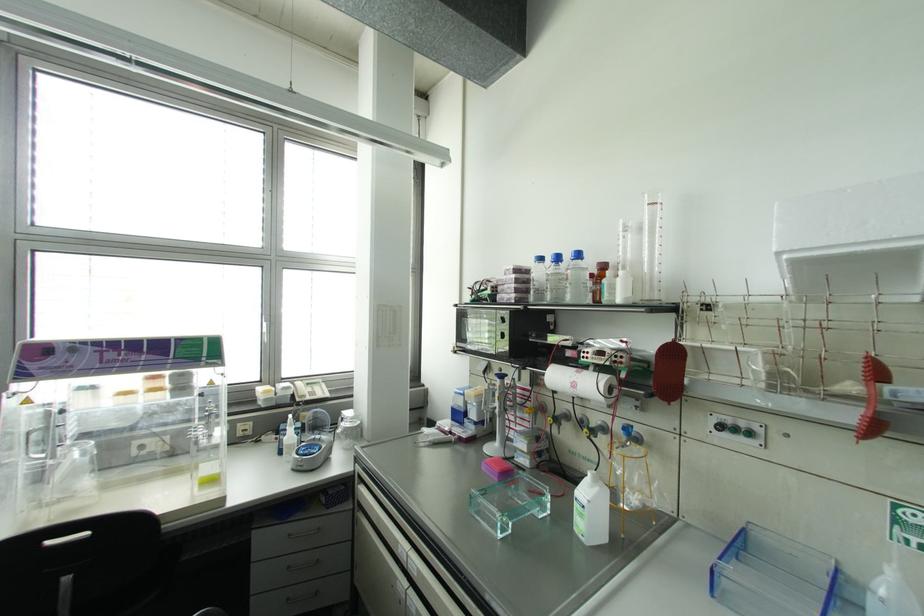
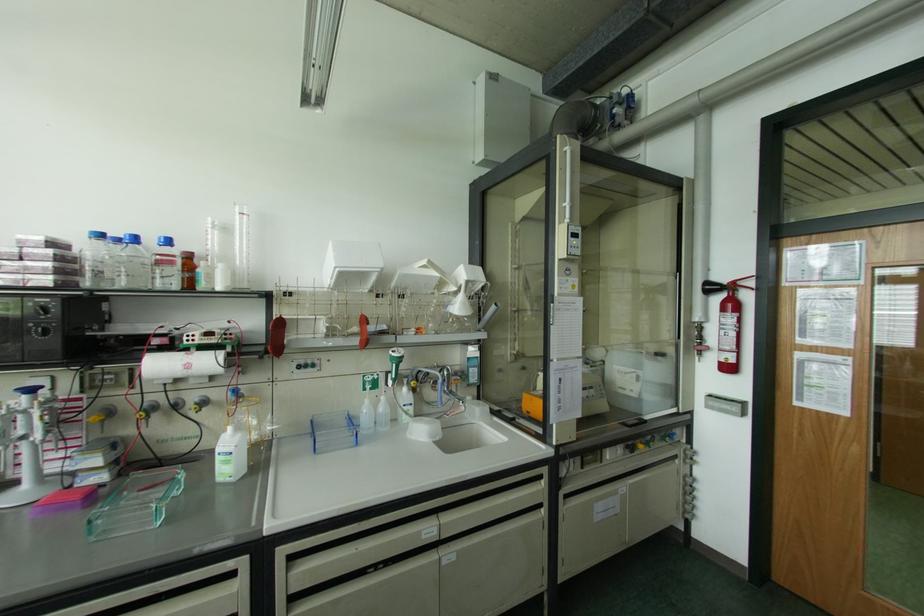
Where in the second image is the point corresponding to (556,257) from the first image?

(134, 238)